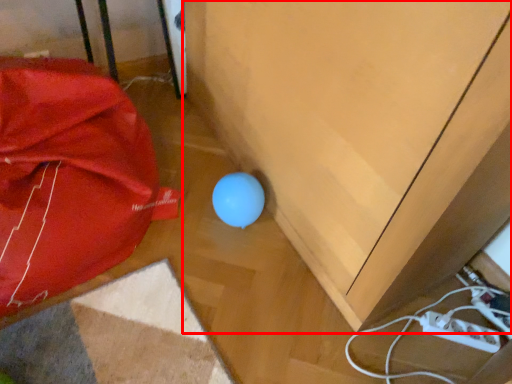
Question: From the image's perspective, what is the correct spatial positioning of furniture (annotated by the red box) in reference to umbrella?

Choices:
 (A) below
 (B) above

Answer: (B)